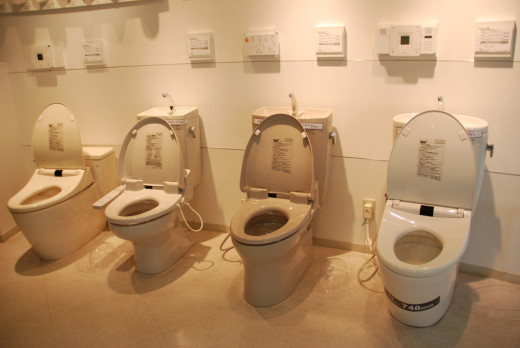
Identify the location of light brown toilets. (296, 211).